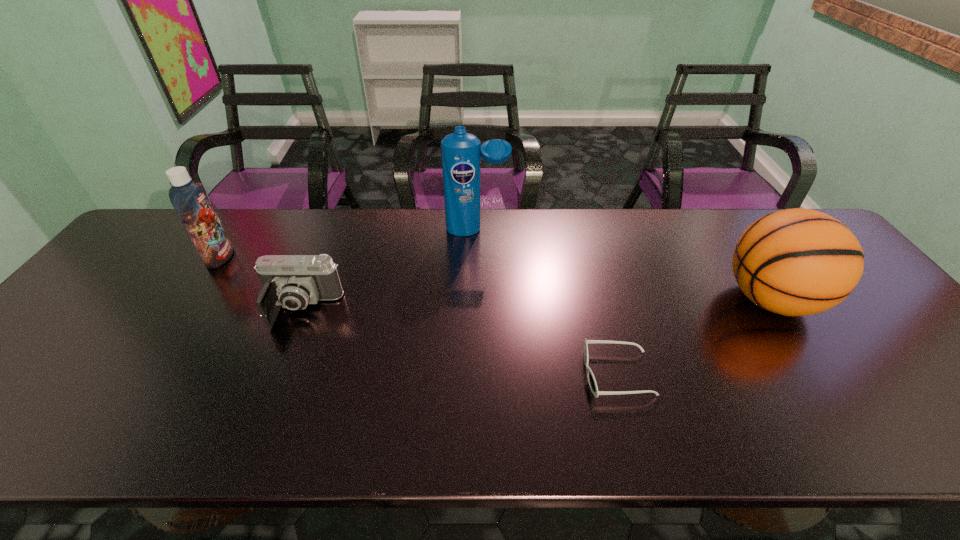
Locate an element on the screen. The width and height of the screenshot is (960, 540). the taller shampoo is located at coordinates (460, 151).

Locate an element on the screen. the farthest object is located at coordinates (460, 151).

This screenshot has height=540, width=960. I want to click on the shorter shampoo, so click(x=189, y=199).

At what (x,y) coordinates should I click in order to perform the action: click on the nearer shampoo. Please return your answer as a coordinate pair (x, y). Image resolution: width=960 pixels, height=540 pixels. Looking at the image, I should click on (189, 199).

Locate an element on the screen. This screenshot has width=960, height=540. the rightmost object is located at coordinates (794, 262).

Locate an element on the screen. camera is located at coordinates (292, 281).

This screenshot has width=960, height=540. Find the location of `the second object from left to right`. the second object from left to right is located at coordinates (292, 281).

Where is `sunglasses`? The width and height of the screenshot is (960, 540). sunglasses is located at coordinates (591, 379).

This screenshot has width=960, height=540. In order to click on the nearest object in this screenshot , I will do click(591, 379).

This screenshot has height=540, width=960. In order to click on vacant space located 0.330m on the right of the farthest object in this screenshot , I will do `click(612, 230)`.